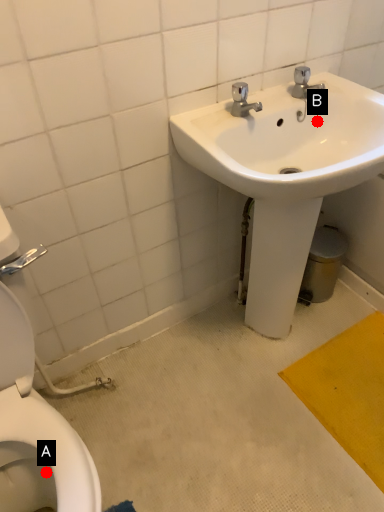
Question: Two points are circled on the image, labeled by A and B beside each circle. Among these points, which one is farthest from the camera?

Choices:
 (A) A is further
 (B) B is further

Answer: (B)